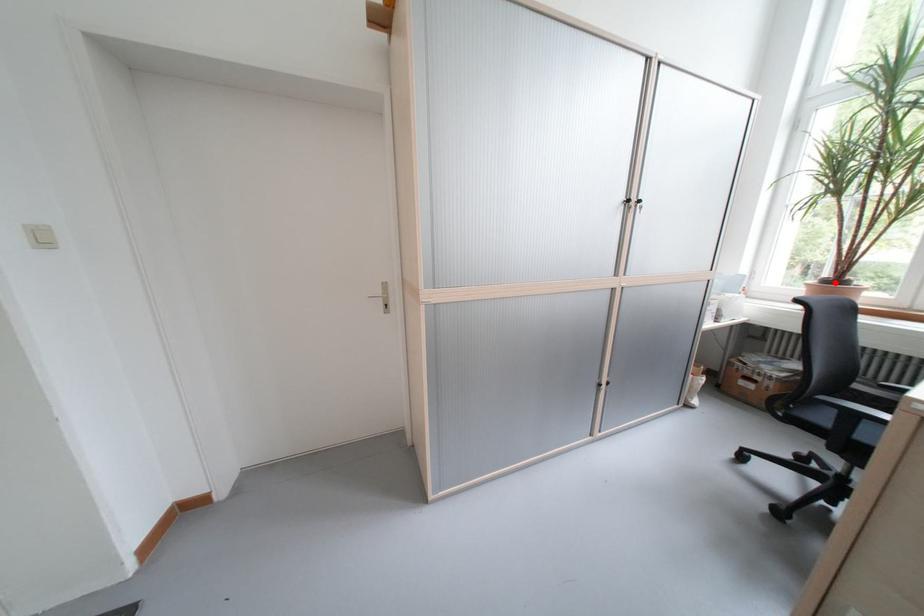
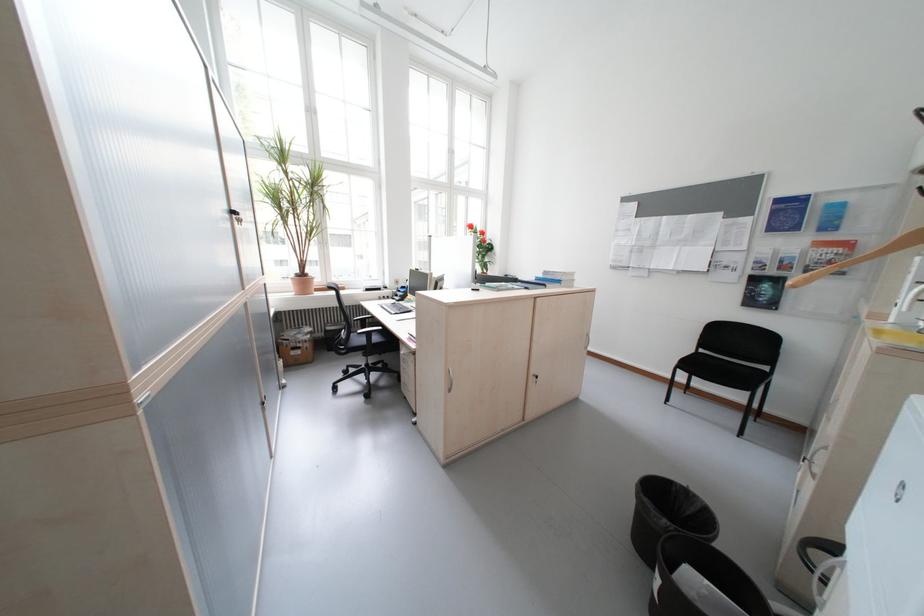
Where in the second image is the point corresponding to the highlighted location from the first image?

(308, 277)